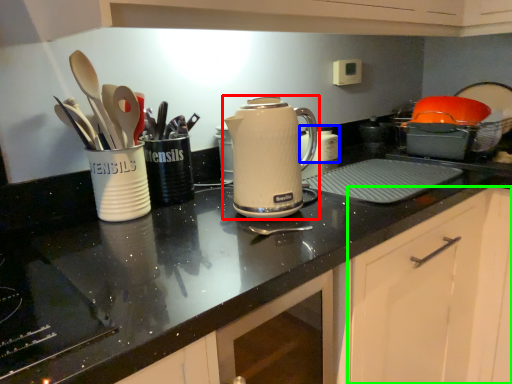
Question: Which object is the farthest from kettle (highlighted by a red box)? Choose among these: appliance (highlighted by a blue box) or cabinetry (highlighted by a green box).

Choices:
 (A) appliance
 (B) cabinetry

Answer: (A)